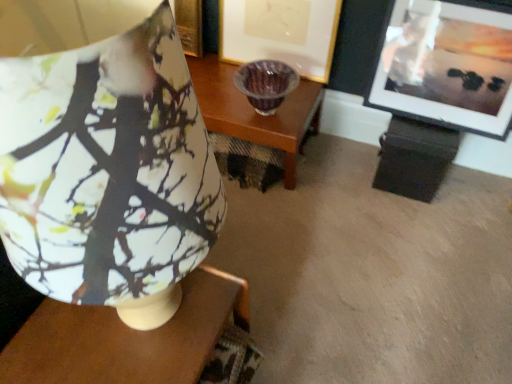
Question: Is point (96, 61) positioned closer to the camera than point (129, 365)?

Choices:
 (A) closer
 (B) farther

Answer: (A)

Question: Looking at their shapes, would you say matte ceramic lampshade at upper left is wider or thinner than matte wood table at center?

Choices:
 (A) wide
 (B) thin

Answer: (B)

Question: Estimate the real-world distances between objects in this image. Which object is closer to the matte ceramic lampshade at upper left?

Choices:
 (A) matte wood table at center
 (B) matte black picture frame at upper right, marked as the 2th picture frame in a left-to-right arrangement
 (C) matte gold picture frame at center, which appears as the 1th picture frame when viewed from the left

Answer: (A)

Question: Considering the real-world distances, which object is farthest from the matte ceramic lampshade at upper left?

Choices:
 (A) matte wood table at center
 (B) matte black picture frame at upper right, which is counted as the 1th picture frame, starting from the right
 (C) matte gold picture frame at center, which is counted as the 2th picture frame, starting from the right

Answer: (B)